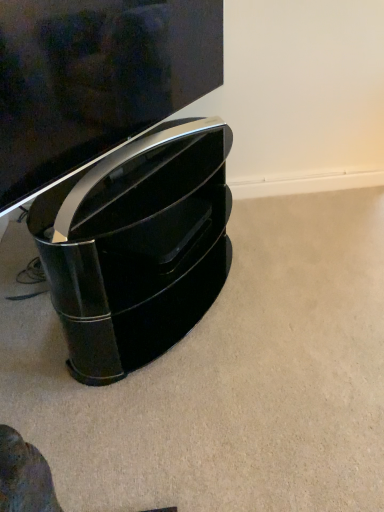
Question: Does glossy black tv at upper center have a larger size compared to glossy black speaker at lower left?

Choices:
 (A) no
 (B) yes

Answer: (A)

Question: From the image's perspective, is glossy black tv at upper center over glossy black speaker at lower left?

Choices:
 (A) no
 (B) yes

Answer: (B)

Question: Is glossy black tv at upper center outside of glossy black speaker at lower left?

Choices:
 (A) yes
 (B) no

Answer: (A)

Question: Considering the relative sizes of glossy black tv at upper center and glossy black speaker at lower left in the image provided, is glossy black tv at upper center shorter than glossy black speaker at lower left?

Choices:
 (A) yes
 (B) no

Answer: (A)

Question: Is glossy black tv at upper center positioned with its back to glossy black speaker at lower left?

Choices:
 (A) yes
 (B) no

Answer: (B)

Question: Is the depth of glossy black tv at upper center greater than that of glossy black speaker at lower left?

Choices:
 (A) no
 (B) yes

Answer: (A)

Question: From a real-world perspective, is glossy black speaker at lower left beneath glossy black tv at upper center?

Choices:
 (A) yes
 (B) no

Answer: (A)

Question: Are glossy black speaker at lower left and glossy black tv at upper center far apart?

Choices:
 (A) yes
 (B) no

Answer: (B)

Question: Does glossy black speaker at lower left appear on the right side of glossy black tv at upper center?

Choices:
 (A) yes
 (B) no

Answer: (A)

Question: From the image's perspective, does glossy black speaker at lower left appear lower than glossy black tv at upper center?

Choices:
 (A) yes
 (B) no

Answer: (A)

Question: Can you confirm if glossy black speaker at lower left is taller than glossy black tv at upper center?

Choices:
 (A) yes
 (B) no

Answer: (A)

Question: Considering the relative sizes of glossy black speaker at lower left and glossy black tv at upper center in the image provided, is glossy black speaker at lower left thinner than glossy black tv at upper center?

Choices:
 (A) yes
 (B) no

Answer: (B)

Question: From the image's perspective, is glossy black tv at upper center positioned above or below glossy black speaker at lower left?

Choices:
 (A) above
 (B) below

Answer: (A)